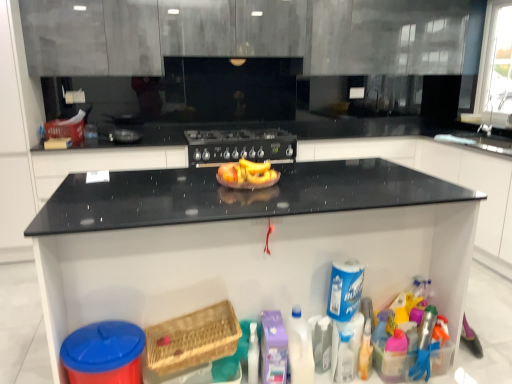
Question: Can translucent plastic bottle at lower right be found inside woven wood basket at lower center?

Choices:
 (A) yes
 (B) no

Answer: (B)

Question: Is woven wood basket at lower center aimed at translucent plastic bottle at lower right?

Choices:
 (A) no
 (B) yes

Answer: (A)

Question: Considering the relative sizes of woven wood basket at lower center and translucent plastic bottle at lower right in the image provided, is woven wood basket at lower center thinner than translucent plastic bottle at lower right?

Choices:
 (A) no
 (B) yes

Answer: (A)

Question: Does woven wood basket at lower center lie behind translucent plastic bottle at lower right?

Choices:
 (A) yes
 (B) no

Answer: (B)

Question: From a real-world perspective, is woven wood basket at lower center physically above translucent plastic bottle at lower right?

Choices:
 (A) yes
 (B) no

Answer: (A)

Question: Does woven wood basket at lower center have a larger size compared to translucent plastic bottle at lower right?

Choices:
 (A) yes
 (B) no

Answer: (A)

Question: Can you confirm if woven wood basket at lower center is wider than black granite countertop at center?

Choices:
 (A) no
 (B) yes

Answer: (A)

Question: Can you confirm if woven wood basket at lower center is bigger than black granite countertop at center?

Choices:
 (A) no
 (B) yes

Answer: (A)

Question: From the image's perspective, would you say woven wood basket at lower center is shown under black granite countertop at center?

Choices:
 (A) no
 (B) yes

Answer: (B)

Question: Is woven wood basket at lower center smaller than black granite countertop at center?

Choices:
 (A) no
 (B) yes

Answer: (B)

Question: From a real-world perspective, is woven wood basket at lower center positioned over black granite countertop at center based on gravity?

Choices:
 (A) yes
 (B) no

Answer: (B)

Question: Would you consider woven wood basket at lower center to be distant from black granite countertop at center?

Choices:
 (A) no
 (B) yes

Answer: (A)

Question: From a real-world perspective, is translucent plastic toy at lower right physically below black granite countertop at center?

Choices:
 (A) yes
 (B) no

Answer: (A)